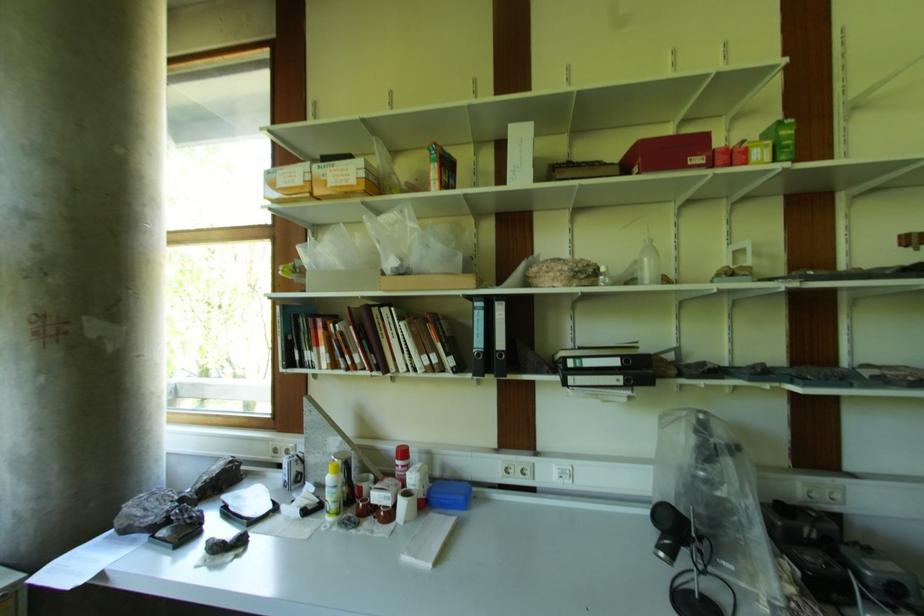
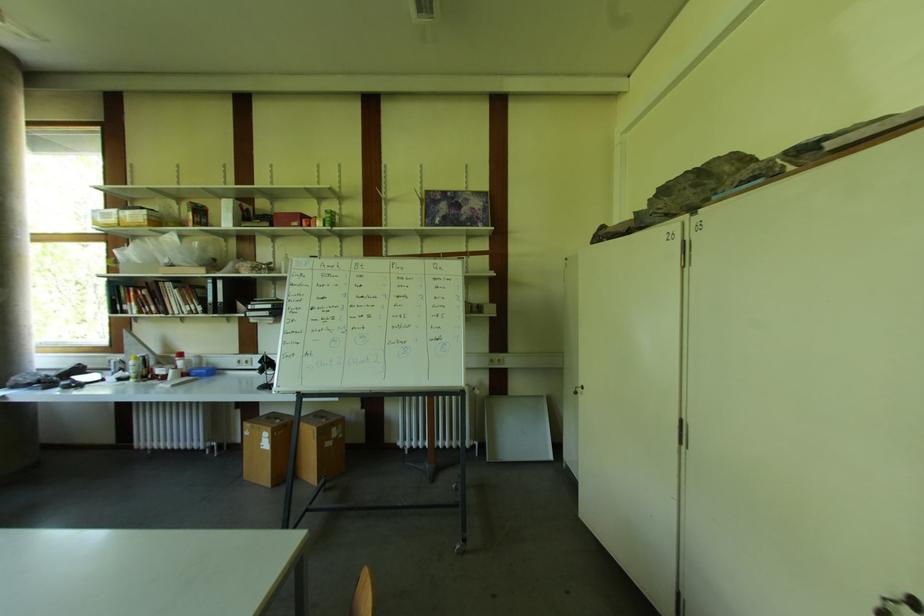
In the second image, find the point that corresponds to point 407,454 in the first image.

(184, 357)